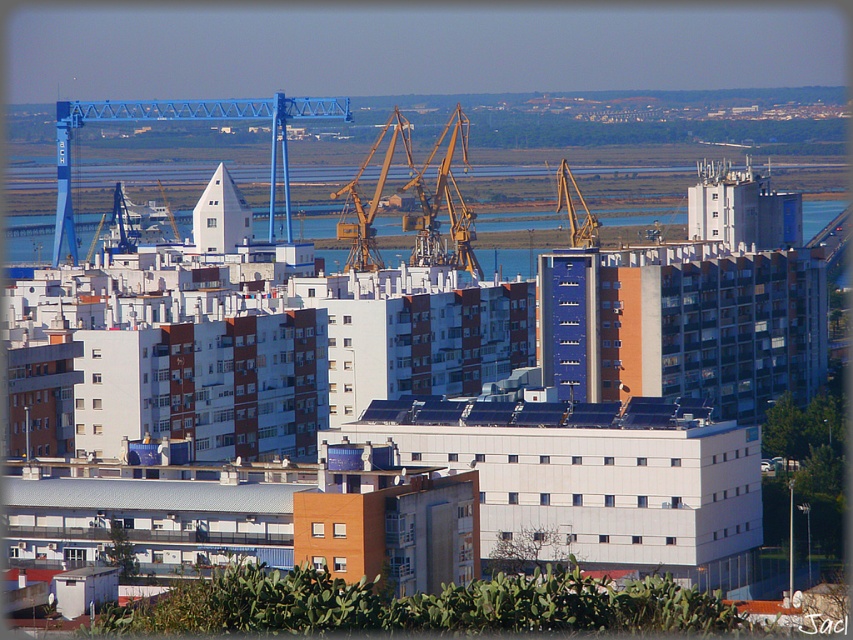
Can you confirm if matte yellow crane at upper center is positioned to the right of blue water at center?

No, matte yellow crane at upper center is not to the right of blue water at center.

Who is higher up, matte yellow crane at upper center or blue water at center?

blue water at center is above.

Between point (297, 285) and point (621, 216), which one is positioned in front?

Positioned in front is point (297, 285).

This screenshot has width=853, height=640. I want to click on matte yellow crane at upper center, so click(x=469, y=342).

How much distance is there between blue metallic crane at upper center and blue water at center?

blue metallic crane at upper center is 76.73 feet away from blue water at center.

Which is more to the right, blue metallic crane at upper center or blue water at center?

blue water at center is more to the right.

Where is `blue metallic crane at upper center`? This screenshot has width=853, height=640. blue metallic crane at upper center is located at coordinates tap(184, 120).

Find the location of a particular element. blue metallic crane at upper center is located at coordinates (184, 120).

Between point (595, 252) and point (236, 118), which one is positioned behind?

Positioned behind is point (236, 118).

What do you see at coordinates (469, 342) in the screenshot? The width and height of the screenshot is (853, 640). I see `matte yellow crane at upper center` at bounding box center [469, 342].

Who is more forward, (744, 330) or (252, 116)?

Point (252, 116) is more forward.

What are the coordinates of `matte yellow crane at upper center` in the screenshot? It's located at (469, 342).